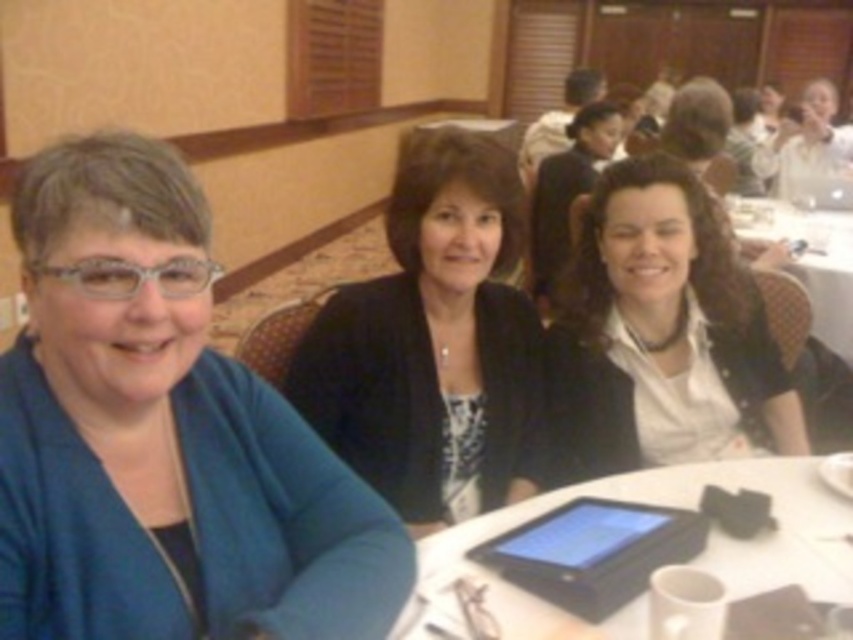
You are a photographer setting up for a group photo in a conference room. You notice the black matte blazer at center and the white matte shirt at center. Which clothing item should you adjust in your composition to ensure both are visible in the frame?

The black matte blazer at center is much taller than the white matte shirt at center, so you should lower the angle or position of the camera to ensure both are fully visible in the frame.

You are a photographer setting up for a group photo. You need to ensure that the black matte blazer at center is visible above the white glossy table at center in the final shot. Based on their current positions, is this possible?

The black matte blazer at center is currently below the white glossy table at center, so adjusting the camera angle or having the person stand up slightly could help achieve visibility above the table.